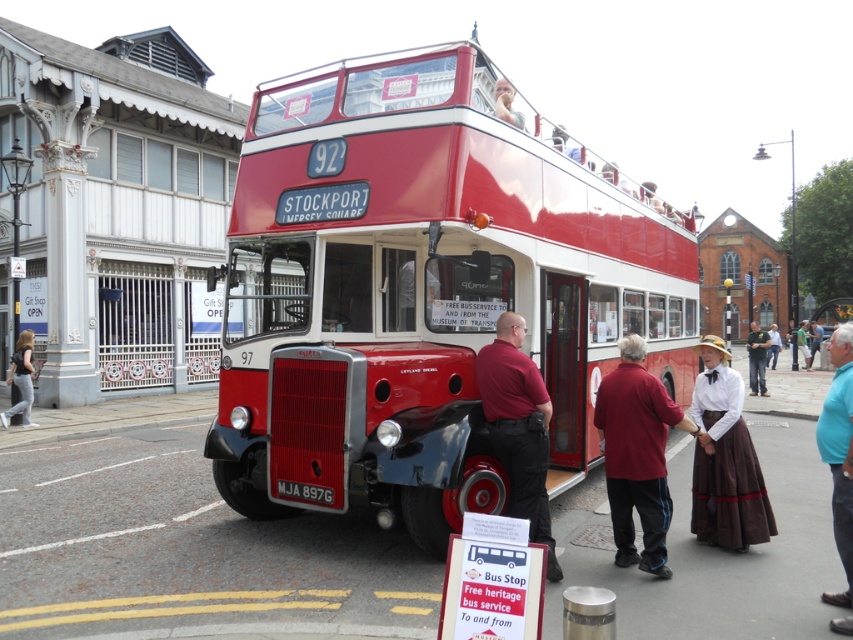
You are a tour guide standing at the corner of the street. You need to direct visitors to the shiny red bus at center. Based on its location coordinates, can you confirm if the bus is positioned exactly at the center of the image?

The shiny red bus at center is located at point coordinates approximately 0.498 on the x and y axes, which is very close to the exact center of the image. Therefore, it can be considered positioned at the center.

You are standing in front of the classic red double decker bus with the signboard stating Free heritage bus service To and from. You notice two points marked on the bus, one at point (547,518) and another at point (776,348). Which point is closer to you?

Point (547,518) is closer to the camera than point (776,348), so the point at (547,518) is closer to you.